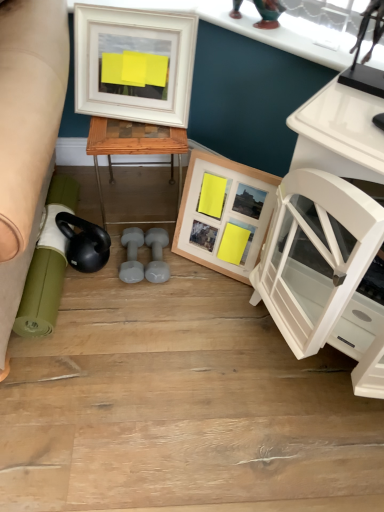
Locate an element on the screen. This screenshot has height=512, width=384. vacant area on the back side of gray rubber dumbbell at center, acting as the 2th dumbbell starting from the right is located at coordinates (137, 213).